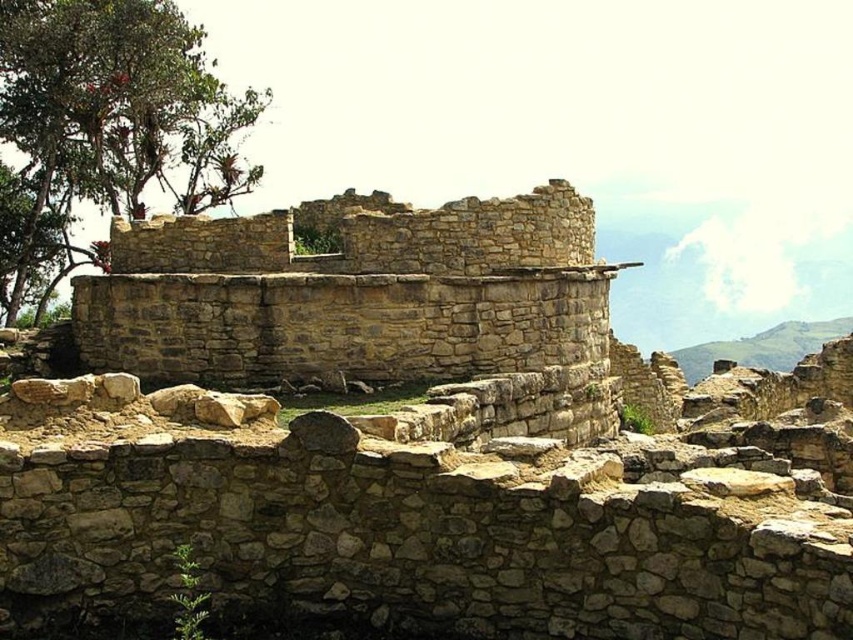
Question: Which object appears farthest from the camera in this image?

Choices:
 (A) green leafy tree at upper left
 (B) natural stone ruins at center

Answer: (A)

Question: Which of the following is the closest to the observer?

Choices:
 (A) (157, 125)
 (B) (274, 545)

Answer: (B)

Question: Can you confirm if natural stone ruins at center is smaller than green leafy tree at upper left?

Choices:
 (A) yes
 (B) no

Answer: (A)

Question: Does natural stone ruins at center appear under green leafy tree at upper left?

Choices:
 (A) no
 (B) yes

Answer: (B)

Question: Does natural stone ruins at center come in front of green leafy tree at upper left?

Choices:
 (A) yes
 (B) no

Answer: (A)